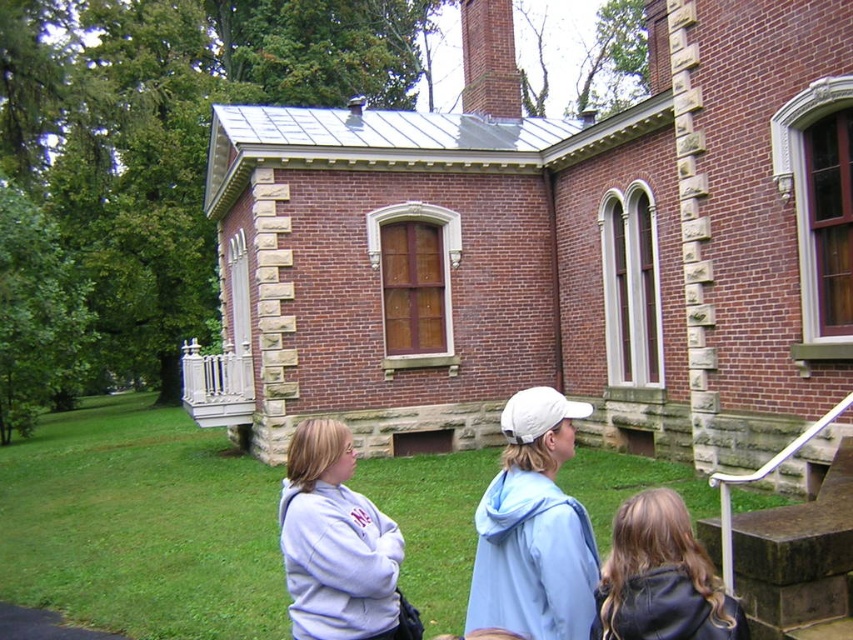
Can you confirm if green grass at lower center is positioned to the left of light purple fleece at center?

Correct, you'll find green grass at lower center to the left of light purple fleece at center.

Does point (451, 564) come behind point (337, 451)?

Yes, point (451, 564) is behind point (337, 451).

Locate an element on the screen. The image size is (853, 640). green grass at lower center is located at coordinates (141, 525).

Is white matte baseball cap at center positioned before light purple fleece at center?

Yes, white matte baseball cap at center is closer to the viewer.

Is white matte baseball cap at center smaller than light purple fleece at center?

Correct, white matte baseball cap at center occupies less space than light purple fleece at center.

Does point (491, 493) come closer to viewer compared to point (392, 602)?

Yes.

This screenshot has width=853, height=640. I want to click on white matte baseball cap at center, so point(532,529).

Is light purple fleece at center below dark brown leather jacket at lower right?

Correct, light purple fleece at center is located below dark brown leather jacket at lower right.

Is point (283, 573) closer to viewer compared to point (608, 564)?

That is False.

Find the location of `light purple fleece at center`. light purple fleece at center is located at coordinates (335, 541).